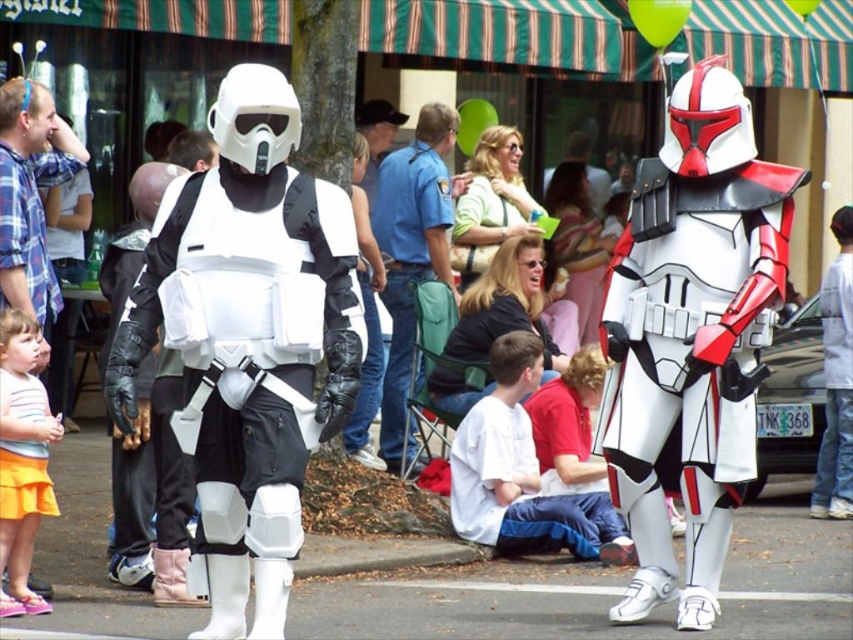
What is located at the coordinates point (521, 492)?

The point (521, 492) marks white matte soft fabric at center.

You are a photographer at the event and want to take a photo that includes both the point at (x=207, y=372) and the point at (x=0, y=404). Which point should you focus on to ensure both are in sharp focus?

You should focus on the point at (x=207, y=372) because it is closer to the camera than the point at (x=0, y=404), ensuring both will be in focus when using the correct depth of field.